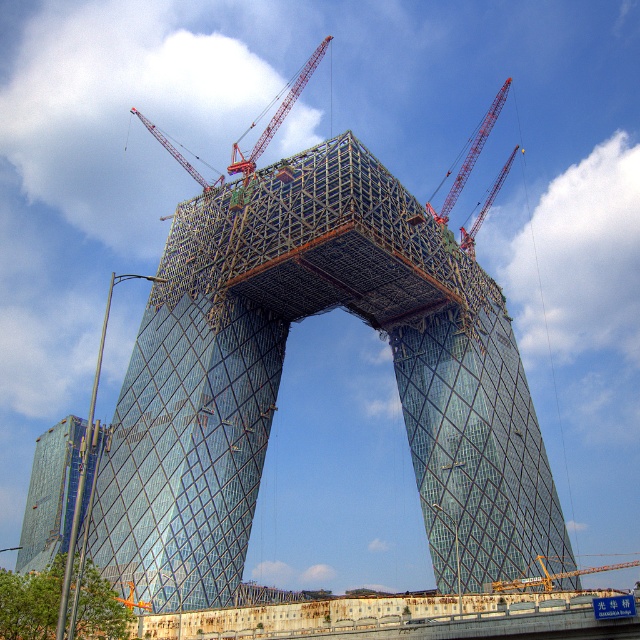
You are an engineer inspecting the construction site of the skyscraper. You notice two red cranes, the red metal crane at upper right and the red metallic crane at upper center. Which crane is shorter?

The red metal crane at upper right is shorter than the red metallic crane at upper center.

You are a construction worker standing at the base of the metallic red crane at upper center. You need to lift a heavy beam that is 100 meters away from your current position. Can you safely operate the crane to reach the beam without moving the crane itself?

The distance between the metallic red crane at upper center and the camera is 90.75 meters. Since the beam is 100 meters away, it is beyond the crane operator can reach without moving the crane.